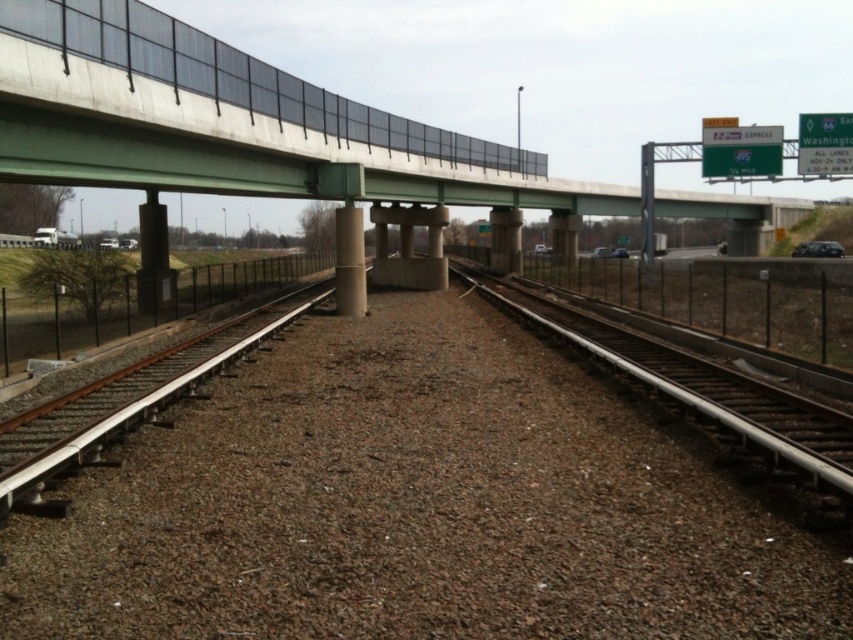
Does rusty metal train track at center have a greater height compared to concrete at center?

In fact, rusty metal train track at center may be shorter than concrete at center.

What do you see at coordinates (701, 388) in the screenshot? I see `rusty metal train track at center` at bounding box center [701, 388].

Where is `rusty metal train track at center`? The image size is (853, 640). rusty metal train track at center is located at coordinates (701, 388).

Can you confirm if rusty metal train track at center is smaller than concrete pillar at center?

Indeed, rusty metal train track at center has a smaller size compared to concrete pillar at center.

Is point (599, 332) more distant than point (151, 289)?

No, it is in front of (151, 289).

You are a GUI agent. You are given a task and a screenshot of the screen. Output one action in this format:
    pyautogui.click(x=<x>, y=<y>)
    Task: Click on the rusty metal train track at center
    This screenshot has height=640, width=853.
    Given the screenshot: What is the action you would take?
    pyautogui.click(x=701, y=388)

Is concrete pillar at center positioned behind concrete at center?

No.

Identify the location of concrete pillar at center. This screenshot has width=853, height=640. (154, 259).

Image resolution: width=853 pixels, height=640 pixels. Find the location of `concrete pillar at center`. concrete pillar at center is located at coordinates (154, 259).